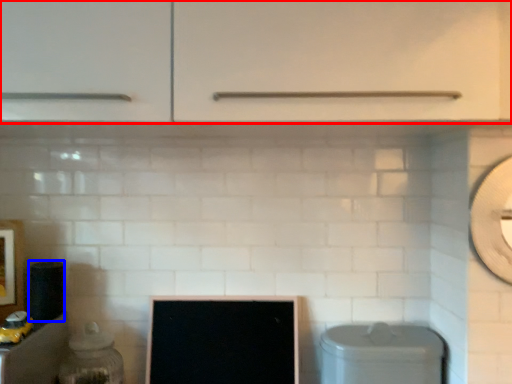
Question: Among these objects, which one is farthest to the camera, cabinetry (highlighted by a red box) or appliance (highlighted by a blue box)?

Choices:
 (A) cabinetry
 (B) appliance

Answer: (B)